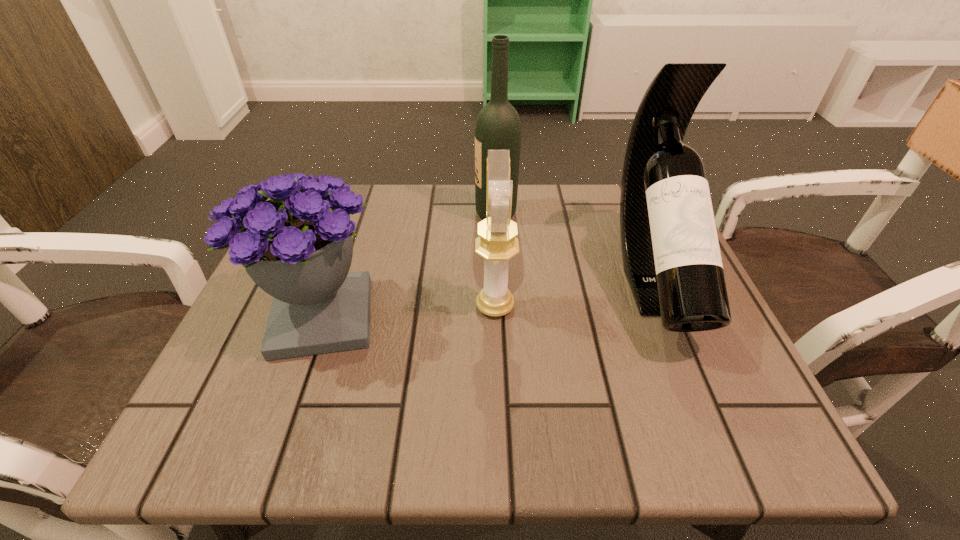
Locate an element on the screen. This screenshot has height=540, width=960. the left wine bottle is located at coordinates (498, 127).

What are the coordinates of `the right wine bottle` in the screenshot? It's located at (671, 257).

Identify the location of award. The width and height of the screenshot is (960, 540). (497, 243).

At what (x,y) coordinates should I click in order to perform the action: click on bouquet. Please return your answer as a coordinate pair (x, y). This screenshot has width=960, height=540. Looking at the image, I should click on (297, 247).

What are the coordinates of `free space located on the labeled side of the left wine bottle` in the screenshot? It's located at (454, 213).

Where is `vacant area located on the labeled side of the left wine bottle`? This screenshot has width=960, height=540. vacant area located on the labeled side of the left wine bottle is located at coordinates (386, 213).

Identify the location of free space located on the labeled side of the left wine bottle. (391, 213).

This screenshot has width=960, height=540. I want to click on vacant region located on the stand of the rightmost object, so click(699, 392).

Locate an element on the screen. The image size is (960, 540). free location located 0.370m on the front-facing side of the award is located at coordinates (277, 306).

Image resolution: width=960 pixels, height=540 pixels. What are the coordinates of `free space located 0.320m on the front-facing side of the award` in the screenshot? It's located at (304, 306).